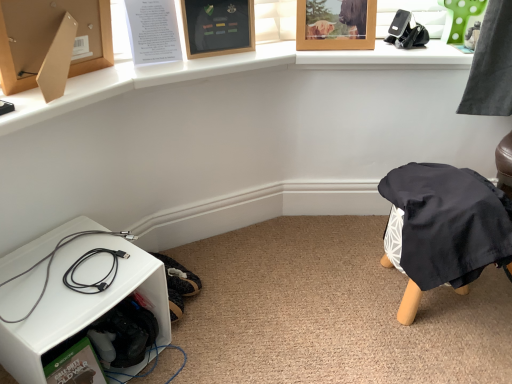
Where is `vacant space that is in between wooden picture frame at upper center, the first picture frame positioned from the left, and wooden picture frame at upper center, positioned as the 2th picture frame in left-to-right order`? vacant space that is in between wooden picture frame at upper center, the first picture frame positioned from the left, and wooden picture frame at upper center, positioned as the 2th picture frame in left-to-right order is located at coordinates (278, 49).